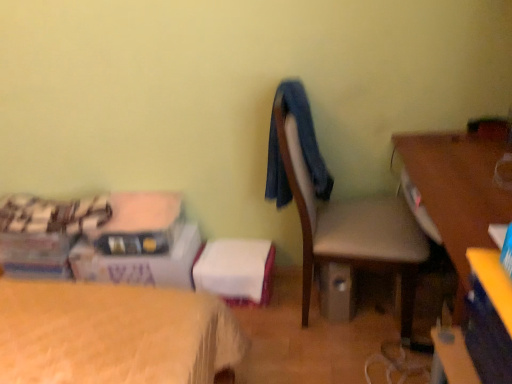
Question: Considering the positions of matte gray chair at center and white cardboard box at lower left in the image, is matte gray chair at center wider or thinner than white cardboard box at lower left?

Choices:
 (A) wide
 (B) thin

Answer: (A)

Question: From their relative heights in the image, would you say matte gray chair at center is taller or shorter than white cardboard box at lower left?

Choices:
 (A) tall
 (B) short

Answer: (A)

Question: Which of these objects is positioned closest to the wooden desk at right?

Choices:
 (A) blue fabric at center
 (B) white cardboard box at lower left
 (C) matte gray chair at center

Answer: (C)

Question: Which object is positioned closest to the matte gray chair at center?

Choices:
 (A) blue fabric at center
 (B) white cardboard box at lower left
 (C) wooden desk at right

Answer: (A)